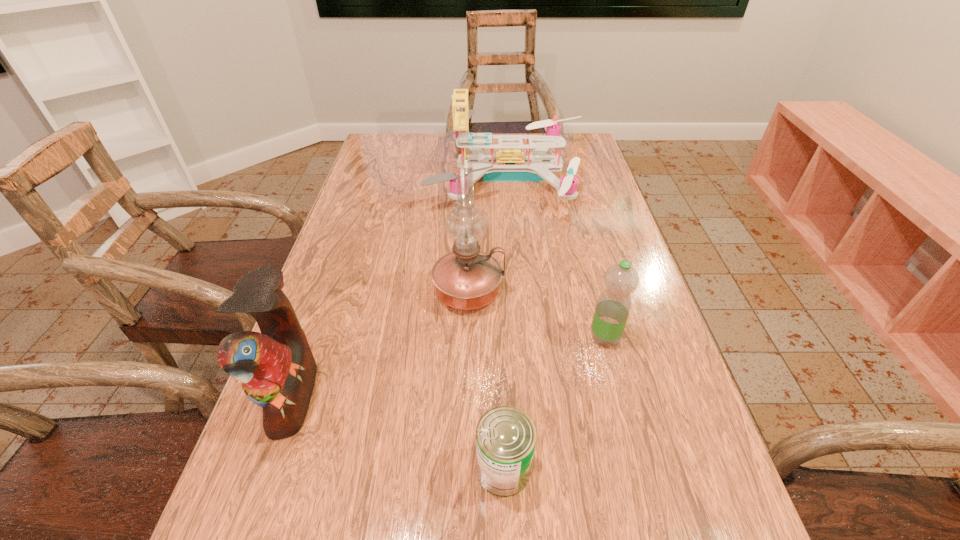
Identify the location of vacant space situated on the front-facing side of the farthest object. (378, 177).

You are a GUI agent. You are given a task and a screenshot of the screen. Output one action in this format:
    pyautogui.click(x=<x>, y=<y>)
    Task: Click on the vacant space located at the face of the parrot
    This screenshot has height=540, width=960.
    Given the screenshot: What is the action you would take?
    pyautogui.click(x=409, y=396)

At what (x,y) coordinates should I click in order to perform the action: click on vacant space located 0.090m on the front of the fourth tallest object. Please return your answer as a coordinate pair (x, y). Looking at the image, I should click on (618, 388).

I want to click on vacant space situated 0.220m on the left of the shortest object, so click(x=338, y=469).

At what (x,y) coordinates should I click in order to perform the action: click on object that is at the far edge. Please return your answer as a coordinate pair (x, y). The image size is (960, 540). Looking at the image, I should click on (509, 164).

Locate an element on the screen. Image resolution: width=960 pixels, height=540 pixels. object present at the left edge is located at coordinates (277, 370).

Locate an element on the screen. The height and width of the screenshot is (540, 960). drone situated at the right edge is located at coordinates (509, 164).

You are a GUI agent. You are given a task and a screenshot of the screen. Output one action in this format:
    pyautogui.click(x=<x>, y=<y>)
    Task: Click on the water bottle that is positioned at the right edge
    This screenshot has width=960, height=540.
    Given the screenshot: What is the action you would take?
    pyautogui.click(x=613, y=306)

What are the coordinates of `object situated at the far right corner` in the screenshot? It's located at point(509,164).

You are a GUI agent. You are given a task and a screenshot of the screen. Output one action in this format:
    pyautogui.click(x=<x>, y=<y>)
    Task: Click on the vacant area at the far edge
    This screenshot has width=960, height=540.
    Given the screenshot: What is the action you would take?
    pyautogui.click(x=456, y=150)